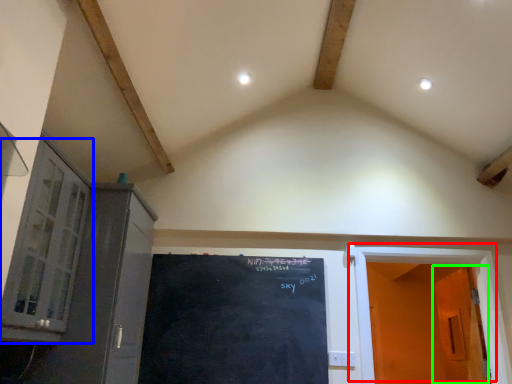
Question: Which object is positioned closest to door (highlighted by a red box)? Select from window (highlighted by a blue box) and door (highlighted by a green box).

Choices:
 (A) window
 (B) door

Answer: (B)